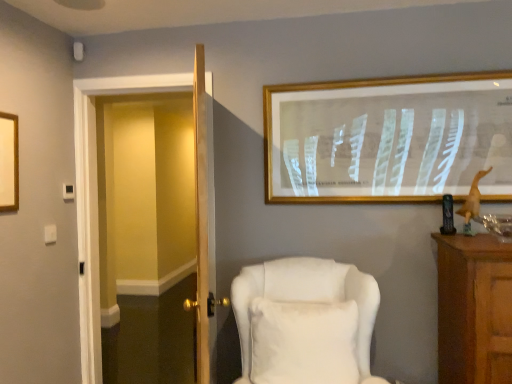
Question: Is transparent glass door at left positioned behind white fluffy pillow at center?

Choices:
 (A) no
 (B) yes

Answer: (B)

Question: Can you confirm if transparent glass door at left is taller than white fluffy pillow at center?

Choices:
 (A) yes
 (B) no

Answer: (A)

Question: From a real-world perspective, is transparent glass door at left physically below white fluffy pillow at center?

Choices:
 (A) yes
 (B) no

Answer: (B)

Question: From a real-world perspective, is transparent glass door at left located higher than white fluffy pillow at center?

Choices:
 (A) yes
 (B) no

Answer: (A)

Question: Can we say transparent glass door at left lies outside white fluffy pillow at center?

Choices:
 (A) yes
 (B) no

Answer: (A)

Question: Is point (287, 281) closer or farther from the camera than point (381, 148)?

Choices:
 (A) farther
 (B) closer

Answer: (B)

Question: From a real-world perspective, is white fabric chair at center above or below gold-framed artwork at upper center?

Choices:
 (A) below
 (B) above

Answer: (A)

Question: Choose the correct answer: Is white fabric chair at center inside gold-framed artwork at upper center or outside it?

Choices:
 (A) inside
 (B) outside

Answer: (B)

Question: From the image's perspective, is white fabric chair at center above or below gold-framed artwork at upper center?

Choices:
 (A) below
 (B) above

Answer: (A)

Question: Is white fluffy pillow at center wider or thinner than transparent glass door at left?

Choices:
 (A) wide
 (B) thin

Answer: (A)

Question: From a real-world perspective, is white fluffy pillow at center above or below transparent glass door at left?

Choices:
 (A) above
 (B) below

Answer: (B)

Question: In the image, is white fluffy pillow at center on the left side or the right side of transparent glass door at left?

Choices:
 (A) left
 (B) right

Answer: (B)

Question: From the image's perspective, is white fluffy pillow at center positioned above or below transparent glass door at left?

Choices:
 (A) above
 (B) below

Answer: (B)

Question: Considering the positions of white fluffy pillow at center and white fabric chair at center in the image, is white fluffy pillow at center taller or shorter than white fabric chair at center?

Choices:
 (A) tall
 (B) short

Answer: (B)

Question: Considering the positions of point (321, 349) and point (355, 296), is point (321, 349) closer or farther from the camera than point (355, 296)?

Choices:
 (A) farther
 (B) closer

Answer: (B)